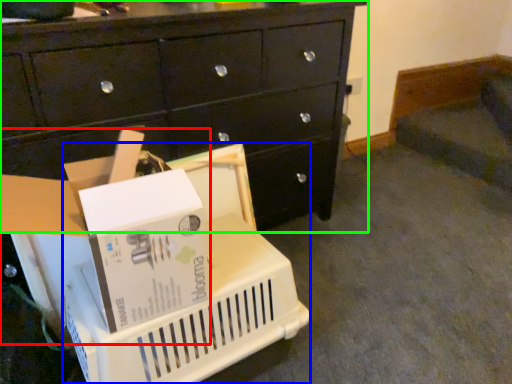
Question: Which object is the farthest from storage box (highlighted by a red box)? Choose among these: basket (highlighted by a blue box) or chest of drawers (highlighted by a green box).

Choices:
 (A) basket
 (B) chest of drawers

Answer: (B)